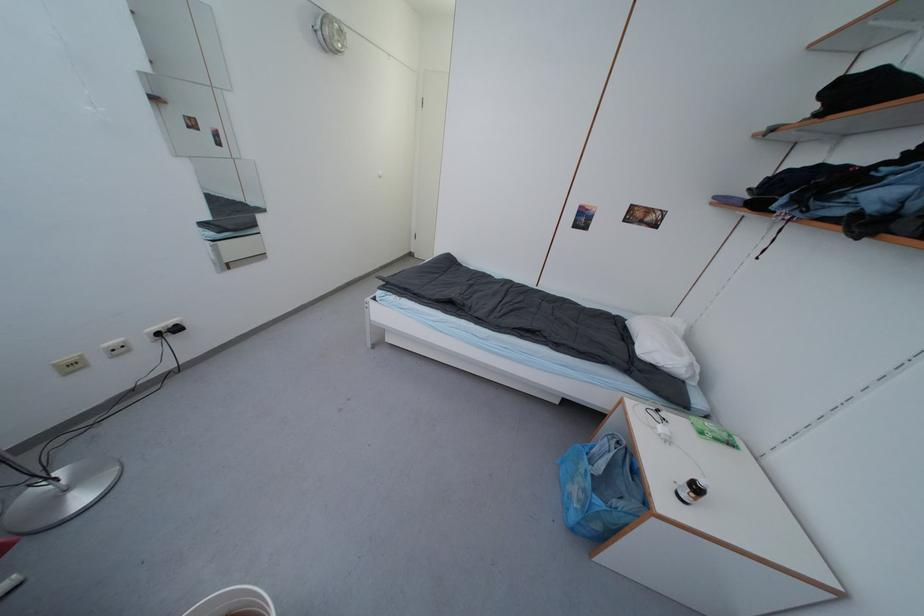
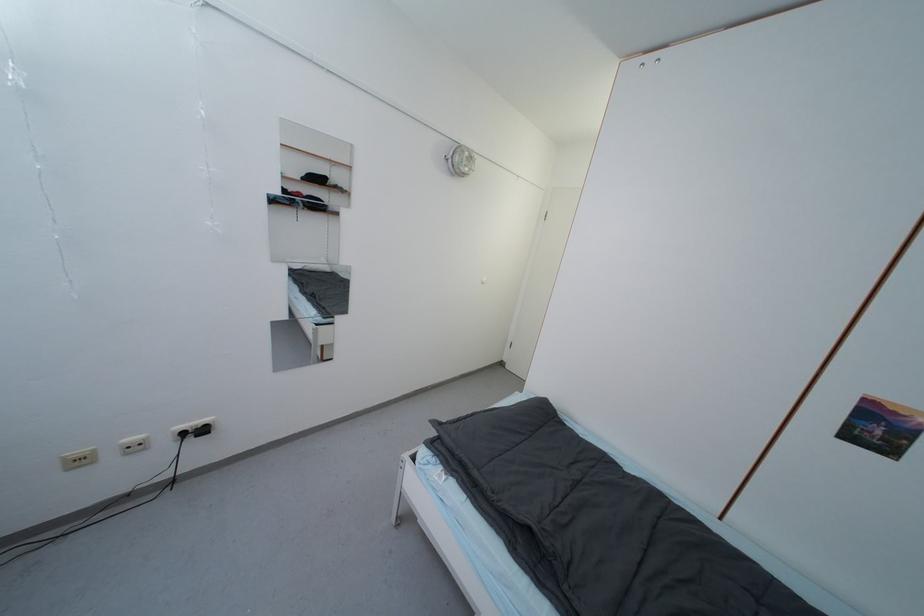
In the second image, find the point that corresponds to point (516, 284) in the first image.

(664, 496)